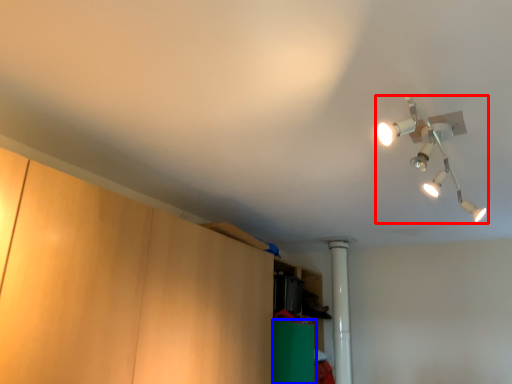
Question: Which of the following is the farthest to the observer, lamp (highlighted by a red box) or cabinetry (highlighted by a blue box)?

Choices:
 (A) lamp
 (B) cabinetry

Answer: (B)